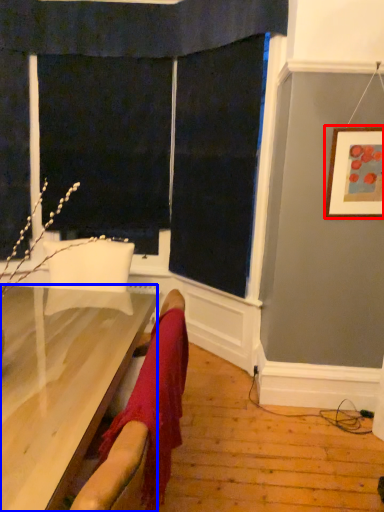
Question: Among these objects, which one is nearest to the camera, picture frame (highlighted by a red box) or furniture (highlighted by a blue box)?

Choices:
 (A) picture frame
 (B) furniture

Answer: (B)